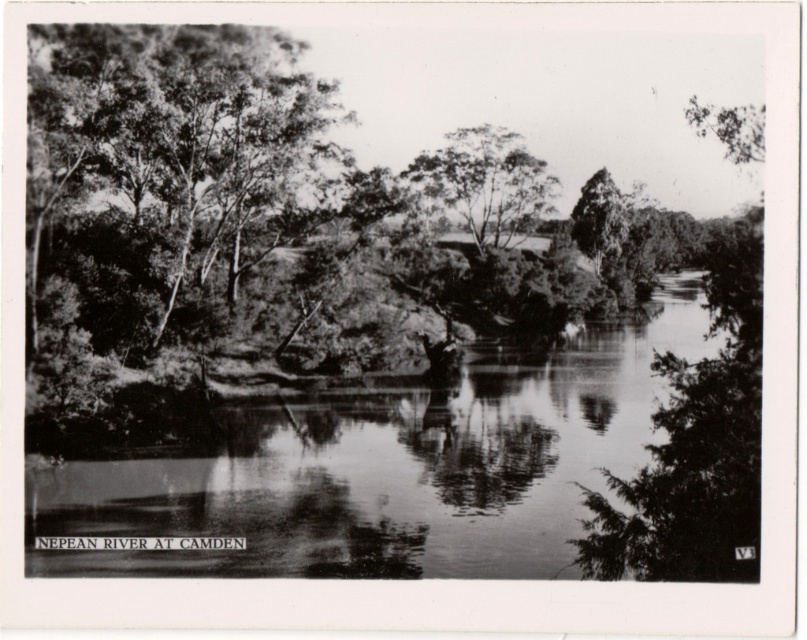
You are planning to cross the river using a small boat that can only carry items up to 1 meter in width. You have two objects in the scene to consider for transport. Which object between the smooth water at center and the smooth bark tree at center would be suitable for the boat to carry based on their widths?

The smooth water at center is wider than the smooth bark tree at center. Since the boat can carry items up to 1 meter in width, the smooth bark tree at center would be suitable for transport as it is narrower than the water, but the description does not specify exact measurements. However, since the water is wider, the tree might still be within the boat capacity. Wait, the question is about carrying the objects themselves, but water and trees are not items to carry. This might be a misunderstanding. The r

You are standing at the rocky outcrop on the left side of the Nepean River at Camden. You want to cross to the smooth water at center marked by point (404,470). Is the path directly across from you towards the point clear of obstacles?

The point (404,470) marks smooth water at center, indicating no obstacles in that area. Therefore, the path directly across from you towards the point is clear of obstacles.